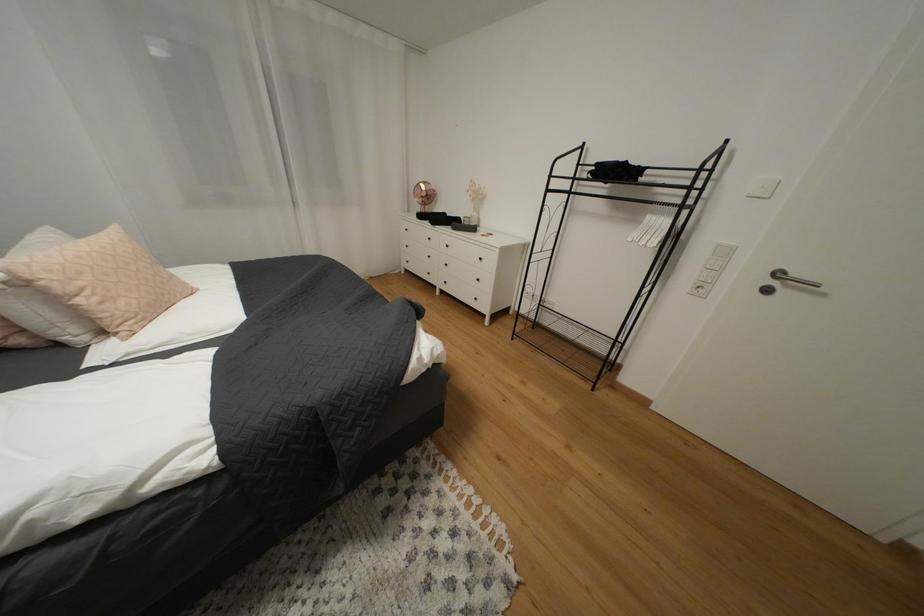
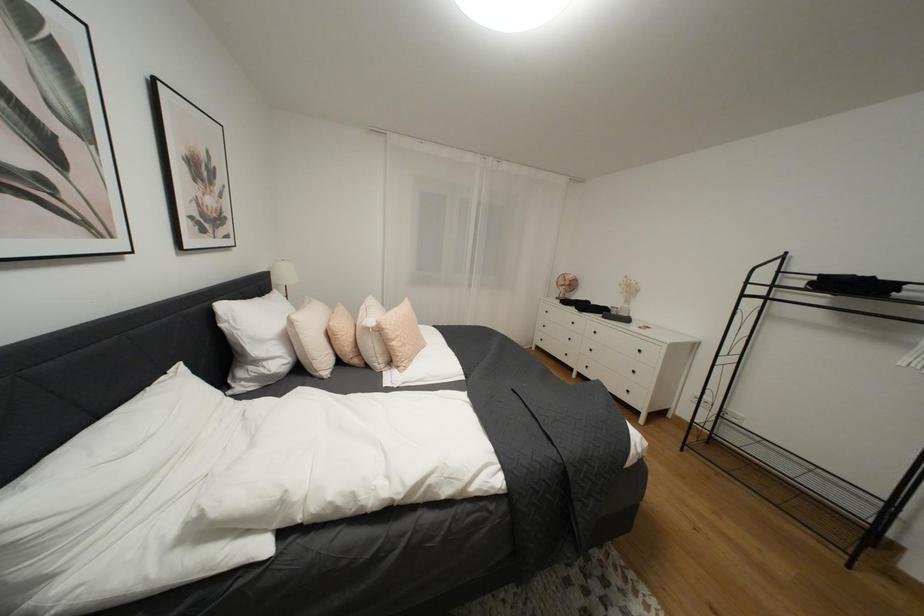
Question: The first image is from the beginning of the video and the second image is from the end. How did the camera likely rotate when shooting the video?

Choices:
 (A) Left
 (B) Right
 (C) Up
 (D) Down

Answer: (A)